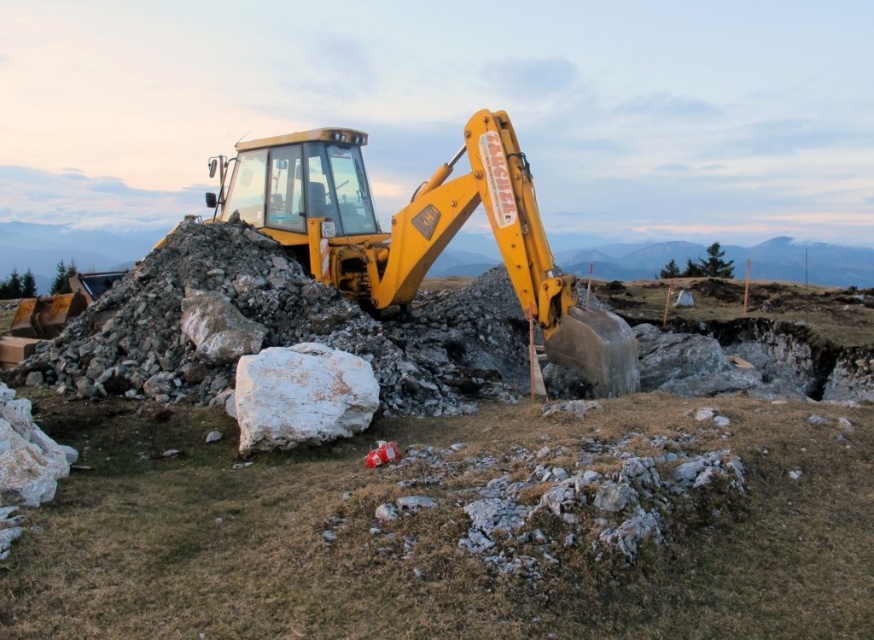
Question: Is yellow metallic excavator at upper center above yellow metallic tractor at center?

Choices:
 (A) no
 (B) yes

Answer: (A)

Question: From the image, what is the correct spatial relationship of yellow metallic excavator at upper center in relation to yellow metallic tractor at center?

Choices:
 (A) above
 (B) below

Answer: (B)

Question: Does yellow metallic excavator at upper center appear under yellow metallic tractor at center?

Choices:
 (A) yes
 (B) no

Answer: (A)